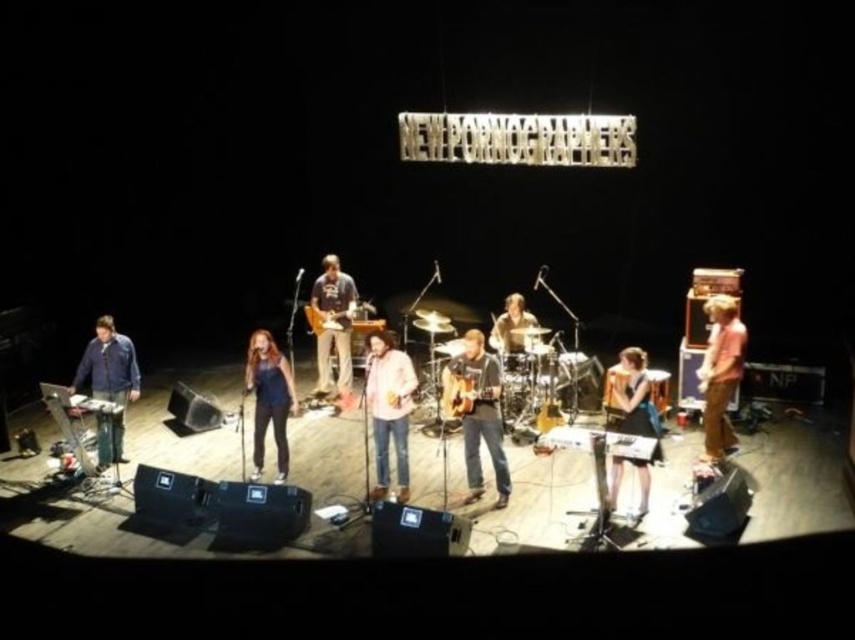
You are a photographer standing at the camera position. You want to capture a closeup of the blue denim jeans at center. Considering the distance, is it feasible to do so without moving the camera?

The blue denim jeans at center is 29.67 feet from the camera. To capture a closeup without moving the camera, you would need a telephoto lens with sufficient zoom capability to cover this distance. A standard lens might not provide enough magnification, so using a telephoto lens would be necessary for a clear closeup.

You are a stagehand setting up a spotlight for the band. The spotlight can only illuminate objects that are at least 1 meter in height. Given that the matte blue shirt at left and the acoustic guitar at center are both in the spotlight area, which one will definitely be illuminated?

The matte blue shirt at left will definitely be illuminated because it has a larger size than the acoustic guitar at center, and the spotlight requires objects to be at least 1 meter in height.

You are a photographer at the back of the venue and want to capture a clear photo of both the blue denim jeans at center and the smooth brown guitar at center. Which object will appear larger in the photo?

The blue denim jeans at center will appear larger in the photo because it is much taller than the smooth brown guitar at center.